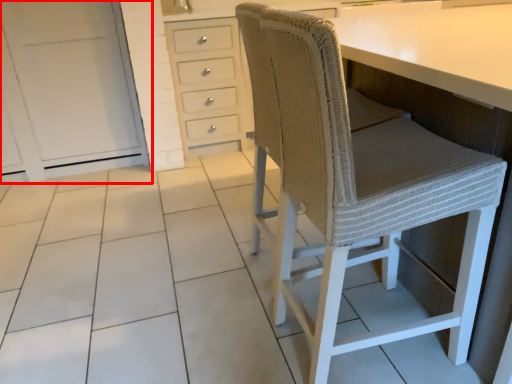
Question: Where is cabinetry (annotated by the red box) located in relation to chair in the image?

Choices:
 (A) left
 (B) right

Answer: (A)